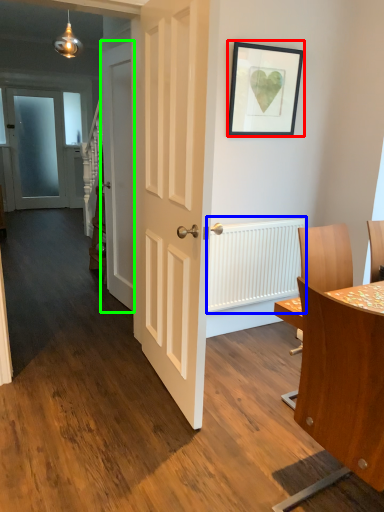
Question: Estimate the real-world distances between objects in this image. Which object is closer to picture frame (highlighted by a red box), radiator (highlighted by a blue box) or door (highlighted by a green box)?

Choices:
 (A) radiator
 (B) door

Answer: (A)